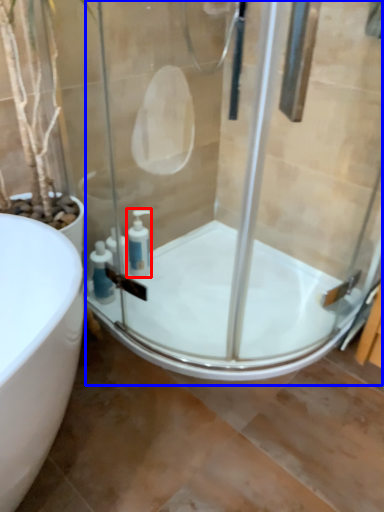
Question: Which of the following is the farthest to the observer, soap dispenser (highlighted by a red box) or shower door (highlighted by a blue box)?

Choices:
 (A) soap dispenser
 (B) shower door

Answer: (A)